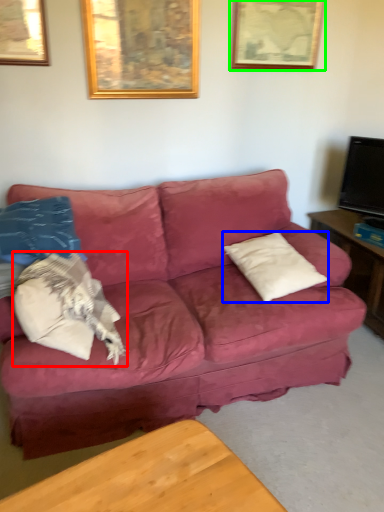
Question: Which object is positioned closest to pillow (highlighted by a red box)? Select from pillow (highlighted by a blue box) and picture frame (highlighted by a green box).

Choices:
 (A) pillow
 (B) picture frame

Answer: (A)